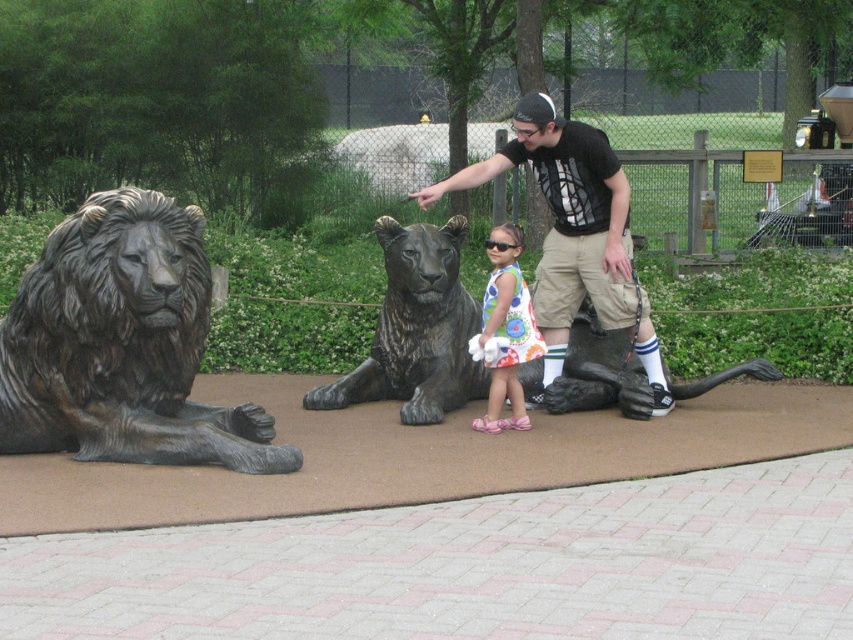
Who is positioned more to the left, bronze lion at left or black t-shirt at center?

bronze lion at left is more to the left.

Is bronze lion at left to the left of black t-shirt at center from the viewer's perspective?

Correct, you'll find bronze lion at left to the left of black t-shirt at center.

Who is more forward, (146, 349) or (563, 337)?

Point (146, 349) is in front.

Where is `bronze lion at left`? Image resolution: width=853 pixels, height=640 pixels. bronze lion at left is located at coordinates (122, 344).

Is point (144, 236) positioned before point (474, 426)?

Yes, point (144, 236) is in front of point (474, 426).

Does bronze lion at left have a lesser width compared to floral dress at center?

Incorrect, bronze lion at left's width is not less than floral dress at center's.

Who is more forward, (67, 397) or (503, 266)?

Point (67, 397) is in front.

Find the location of a particular element. bronze lion at left is located at coordinates (122, 344).

Is point (602, 150) more distant than point (497, 376)?

Yes.

Locate an element on the screen. This screenshot has height=640, width=853. black t-shirt at center is located at coordinates (573, 232).